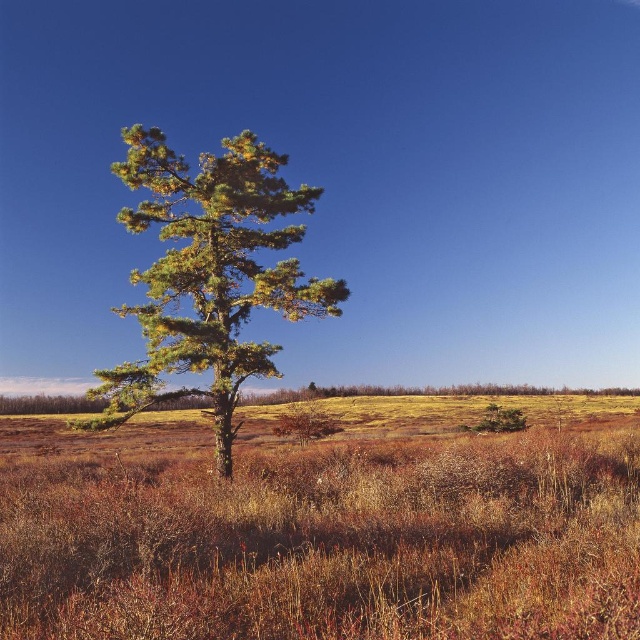
Question: Does brown dry grass at center have a greater width compared to green needle-like tree at left?

Choices:
 (A) no
 (B) yes

Answer: (B)

Question: Which point is farther from the camera taking this photo?

Choices:
 (A) (312, 308)
 (B) (173, 589)

Answer: (A)

Question: Among these objects, which one is nearest to the camera?

Choices:
 (A) green needle-like tree at left
 (B) brown dry grass at center

Answer: (B)

Question: Where is brown dry grass at center located in relation to green needle-like tree at left in the image?

Choices:
 (A) left
 (B) right

Answer: (B)

Question: Does brown dry grass at center lie behind green needle-like tree at left?

Choices:
 (A) yes
 (B) no

Answer: (B)

Question: Which of the following is the closest to the observer?

Choices:
 (A) brown dry grass at center
 (B) green needle-like tree at left

Answer: (A)